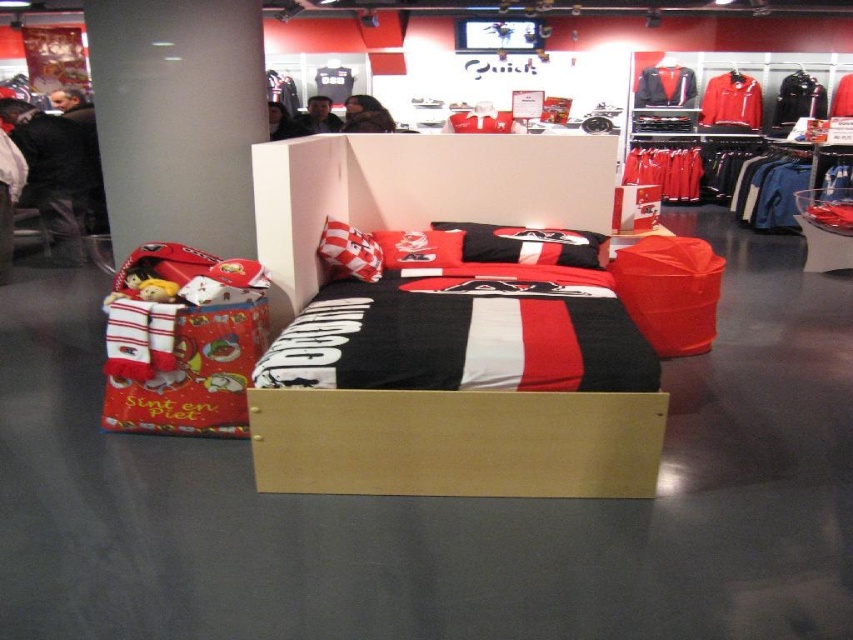
Question: Which point is closer to the camera?

Choices:
 (A) (486, 250)
 (B) (670, 70)
 (C) (61, 252)
 (D) (735, 125)

Answer: (A)

Question: Does black cotton shirt at left have a greater width compared to red polyester jacket at center?

Choices:
 (A) no
 (B) yes

Answer: (B)

Question: Which point is farther from the camera taking this photo?

Choices:
 (A) (67, 188)
 (B) (312, 124)
 (C) (299, 156)
 (D) (521, 252)

Answer: (A)

Question: Which of the following is the farthest from the observer?

Choices:
 (A) matte black bed at center
 (B) black cotton shirt at left
 (C) matte black jacket at center

Answer: (B)

Question: Is black matte pillow at center further to camera compared to black leather jacket at center?

Choices:
 (A) no
 (B) yes

Answer: (A)

Question: In this image, where is red fabric bean bag chair at center located relative to red polyester jacket at center?

Choices:
 (A) above
 (B) below

Answer: (B)